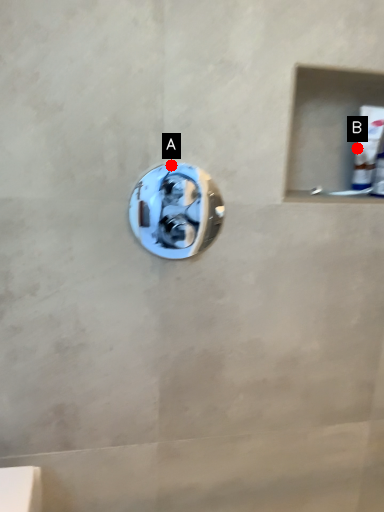
Question: Two points are circled on the image, labeled by A and B beside each circle. Which point appears farthest from the camera in this image?

Choices:
 (A) A is further
 (B) B is further

Answer: (B)